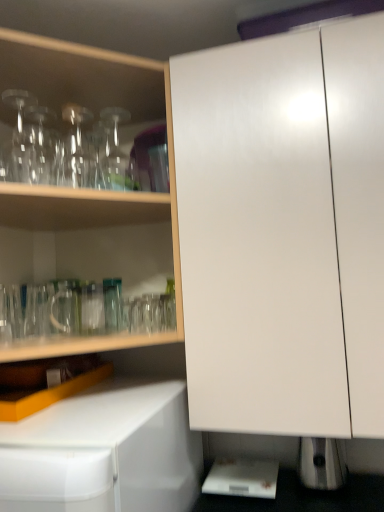
Question: Are transparent glass bottle at upper left, acting as the second bottle starting from the right, and transparent glass bottle at upper left, acting as the second bottle starting from the left, located far from each other?

Choices:
 (A) no
 (B) yes

Answer: (A)

Question: From the image's perspective, is transparent glass bottle at upper left, acting as the second bottle starting from the right, under transparent glass bottle at upper left, which is the 1th bottle in right-to-left order?

Choices:
 (A) yes
 (B) no

Answer: (B)

Question: Considering the relative sizes of transparent glass bottle at upper left, acting as the second bottle starting from the right, and transparent glass bottle at upper left, which is the 1th bottle in right-to-left order, in the image provided, is transparent glass bottle at upper left, acting as the second bottle starting from the right, bigger than transparent glass bottle at upper left, which is the 1th bottle in right-to-left order,?

Choices:
 (A) no
 (B) yes

Answer: (B)

Question: From a real-world perspective, is transparent glass bottle at upper left, acting as the second bottle starting from the right, on transparent glass bottle at upper left, acting as the second bottle starting from the left?

Choices:
 (A) yes
 (B) no

Answer: (A)

Question: Does transparent glass bottle at upper left, the first bottle when ordered from left to right, turn towards transparent glass bottle at upper left, acting as the second bottle starting from the left?

Choices:
 (A) yes
 (B) no

Answer: (B)

Question: Does transparent glass bottle at upper left, acting as the second bottle starting from the right, appear on the left side of transparent glass bottle at upper left, which is the 1th bottle in right-to-left order?

Choices:
 (A) no
 (B) yes

Answer: (B)

Question: Is transparent glassware at upper left, marked as the 2th cabinetry in a right-to-left arrangement, oriented away from white glossy cabinet at center, which appears as the 1th cabinetry when viewed from the right?

Choices:
 (A) no
 (B) yes

Answer: (A)

Question: Considering the relative sizes of transparent glassware at upper left, arranged as the first cabinetry when viewed from the left, and white glossy cabinet at center, which appears as the 1th cabinetry when viewed from the right, in the image provided, is transparent glassware at upper left, arranged as the first cabinetry when viewed from the left, bigger than white glossy cabinet at center, which appears as the 1th cabinetry when viewed from the right,?

Choices:
 (A) yes
 (B) no

Answer: (A)

Question: Is transparent glassware at upper left, arranged as the first cabinetry when viewed from the left, taller than white glossy cabinet at center, which appears as the 1th cabinetry when viewed from the right?

Choices:
 (A) yes
 (B) no

Answer: (B)

Question: From the image's perspective, is transparent glassware at upper left, arranged as the first cabinetry when viewed from the left, on white glossy cabinet at center, marked as the second cabinetry in a left-to-right arrangement?

Choices:
 (A) no
 (B) yes

Answer: (B)

Question: Can you confirm if transparent glassware at upper left, marked as the 2th cabinetry in a right-to-left arrangement, is positioned to the left of white glossy cabinet at center, which appears as the 1th cabinetry when viewed from the right?

Choices:
 (A) no
 (B) yes

Answer: (B)

Question: Could you tell me if transparent glassware at upper left, marked as the 2th cabinetry in a right-to-left arrangement, is turned towards white glossy cabinet at center, marked as the second cabinetry in a left-to-right arrangement?

Choices:
 (A) yes
 (B) no

Answer: (B)

Question: Does transparent glass bottle at upper left, which is the 1th bottle in right-to-left order, come behind transparent glassware at upper left, arranged as the first cabinetry when viewed from the left?

Choices:
 (A) yes
 (B) no

Answer: (A)